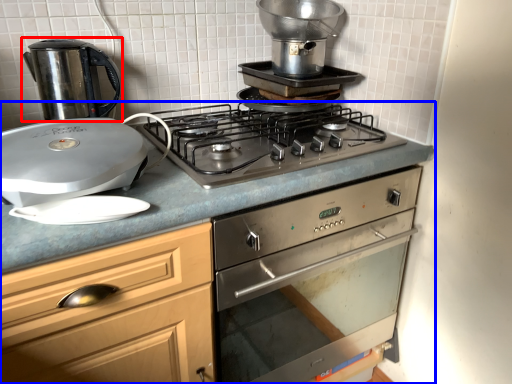
Question: Which object is closer to the camera taking this photo, kitchen appliance (highlighted by a red box) or countertop (highlighted by a blue box)?

Choices:
 (A) kitchen appliance
 (B) countertop

Answer: (B)